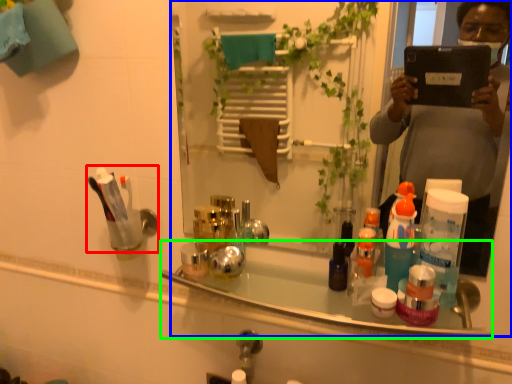
Question: Which object is the farthest from toiletry (highlighted by a red box)? Choose among these: mirror (highlighted by a blue box) or bath (highlighted by a green box).

Choices:
 (A) mirror
 (B) bath

Answer: (A)